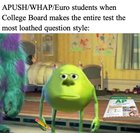
Where is `brown wall`? The height and width of the screenshot is (133, 140). brown wall is located at coordinates (63, 47).